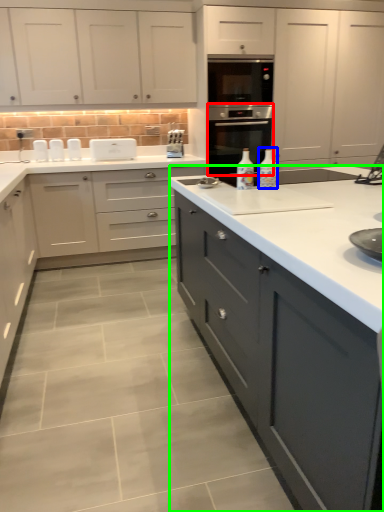
Question: Based on their relative distances, which object is nearer to home appliance (highlighted by a red box)? Choose from bottle (highlighted by a blue box) and cabinetry (highlighted by a green box).

Choices:
 (A) bottle
 (B) cabinetry

Answer: (A)